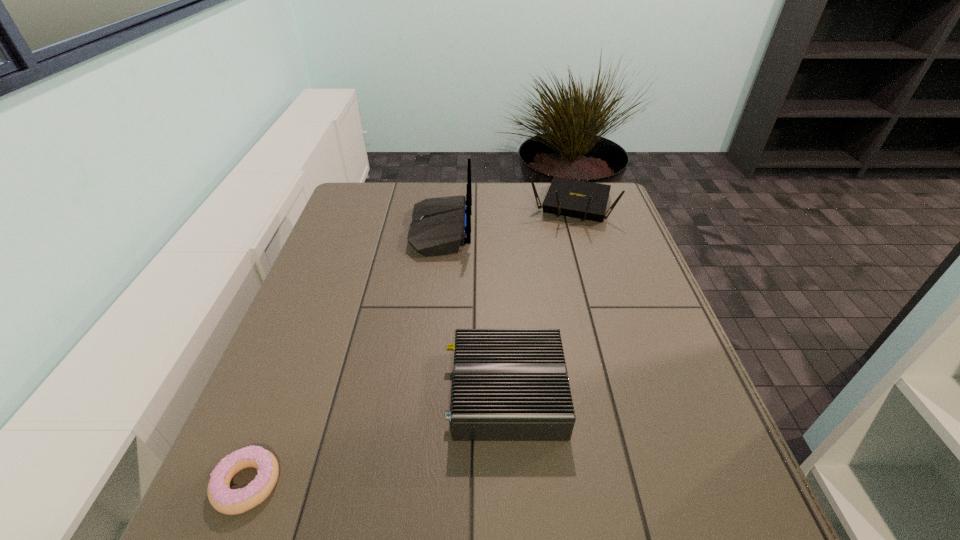
Find the location of a particular element. This screenshot has height=540, width=960. vacant area between the third shortest object and the shortest router is located at coordinates (539, 300).

Find the location of a particular element. vacant point located between the second tallest router and the shortest object is located at coordinates (409, 345).

The image size is (960, 540). In order to click on blank region between the third shortest object and the second shortest object in this screenshot , I will do coord(539,300).

Where is `unoccupied position between the tallest object and the shortest router`? Image resolution: width=960 pixels, height=540 pixels. unoccupied position between the tallest object and the shortest router is located at coordinates tap(473, 312).

Locate an element on the screen. free space between the tallest router and the second nearest object is located at coordinates (473, 312).

At what (x,y) coordinates should I click in order to perform the action: click on free space between the second shortest object and the third shortest object. Please return your answer as a coordinate pair (x, y). This screenshot has width=960, height=540. Looking at the image, I should click on (539, 300).

Locate an element on the screen. vacant point located between the shortest router and the second tallest router is located at coordinates (539, 300).

This screenshot has height=540, width=960. What are the coordinates of `unoccupied position between the leftmost object and the second shortest router` in the screenshot? It's located at (409, 345).

Find the location of a particular element. empty space that is in between the third shortest object and the shortest object is located at coordinates (409, 345).

Locate an element on the screen. This screenshot has width=960, height=540. free space between the shortest object and the tallest router is located at coordinates (344, 357).